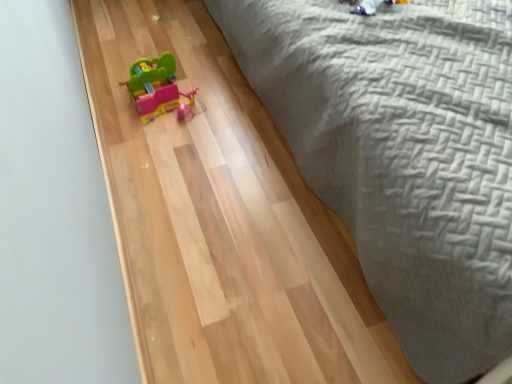
What are the coordinates of `free space underneath matte plastic toy car at center (from a real-world perspective)` in the screenshot? It's located at (169, 102).